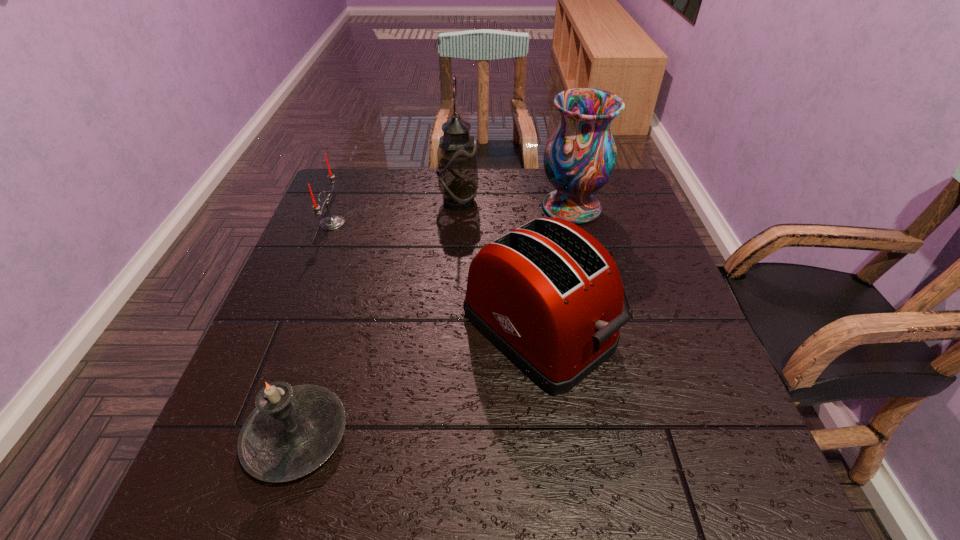
Find the location of `oil lamp`. oil lamp is located at coordinates (457, 169).

Where is `vase`? This screenshot has height=540, width=960. vase is located at coordinates (579, 158).

Find the location of `toaster`. toaster is located at coordinates point(547,294).

You are a GUI agent. You are given a task and a screenshot of the screen. Output one action in this format:
    pyautogui.click(x=<x>, y=<y>)
    Task: Click on the farther candle
    
    Given the screenshot: What is the action you would take?
    (332, 222)

Where is `the nearer candle`? This screenshot has height=540, width=960. the nearer candle is located at coordinates [292, 431].

Find the location of `vacant region located 0.180m on the right of the oil lamp`. vacant region located 0.180m on the right of the oil lamp is located at coordinates (542, 202).

This screenshot has width=960, height=540. I want to click on vacant position located on the right of the vase, so tap(640, 207).

The height and width of the screenshot is (540, 960). I want to click on vacant space located 0.140m on the left of the third tallest object, so click(x=396, y=329).

Where is `blank space located on the front-facing side of the farther candle`? blank space located on the front-facing side of the farther candle is located at coordinates (375, 223).

This screenshot has width=960, height=540. What are the coordinates of `blank space located on the right of the nearer candle` in the screenshot? It's located at (530, 436).